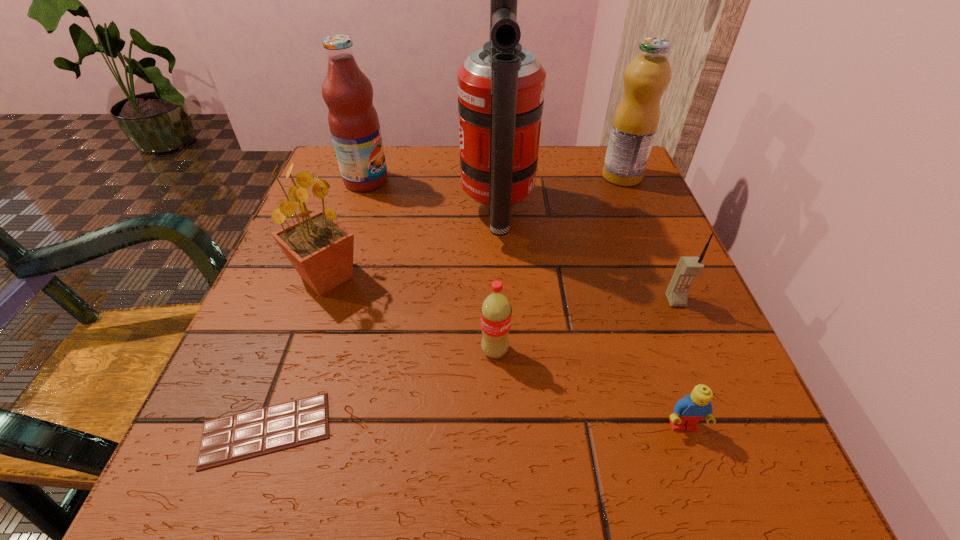
Where is `fire extinguisher that is at the far edge`? fire extinguisher that is at the far edge is located at coordinates (501, 85).

Identify the location of Lego positioned at the near edge. (688, 411).

Locate an element on the screen. Image resolution: width=960 pixels, height=540 pixels. chocolate bar at the near edge is located at coordinates (x=248, y=434).

This screenshot has width=960, height=540. I want to click on fruit juice that is at the left edge, so click(x=348, y=93).

Locate an element on the screen. sunflower located at the left edge is located at coordinates (320, 248).

Where is `chocolate bar that is at the left edge`? The image size is (960, 540). chocolate bar that is at the left edge is located at coordinates (248, 434).

I want to click on fruit juice present at the right edge, so click(635, 123).

Find the location of a particular element. cellular telephone positioned at the right edge is located at coordinates (687, 268).

You are a GUI agent. You are given a task and a screenshot of the screen. Output one action in this format:
    pyautogui.click(x=<x>, y=<y>)
    Task: Click on the Lego that is at the right edge
    This screenshot has height=540, width=960.
    Given the screenshot: What is the action you would take?
    pyautogui.click(x=688, y=411)

Where is `object present at the far left corner`? Image resolution: width=960 pixels, height=540 pixels. object present at the far left corner is located at coordinates (348, 93).